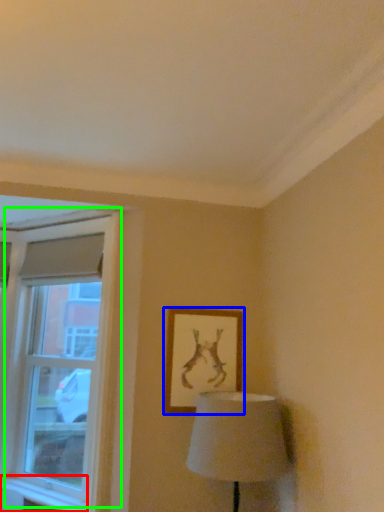
Question: Estimate the real-world distances between objects in this image. Which object is closer to window sill (highlighted by a red box), picture frame (highlighted by a blue box) or window (highlighted by a green box)?

Choices:
 (A) picture frame
 (B) window

Answer: (B)